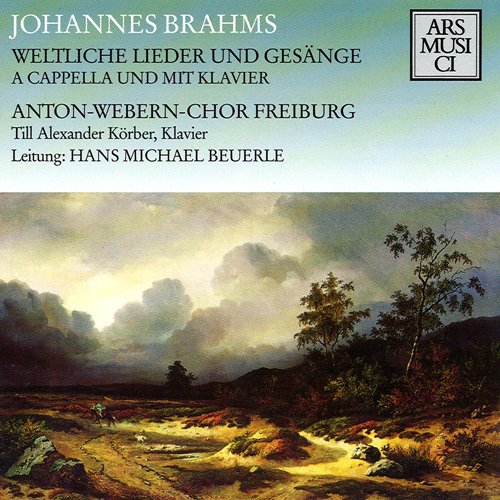
The width and height of the screenshot is (500, 500). In order to click on art in this screenshot , I will do `click(257, 370)`, `click(204, 372)`.